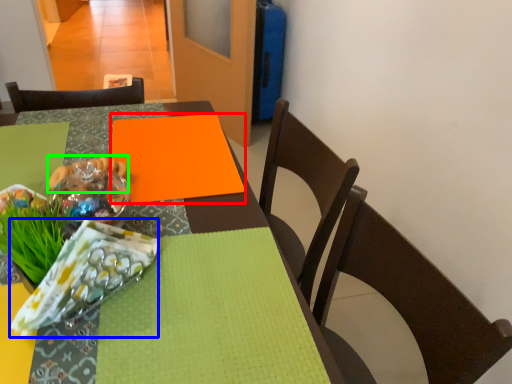
Question: Estimate the real-world distances between objects in this image. Which object is closer to linen (highlighted by a red box), material (highlighted by a blue box) or food (highlighted by a green box)?

Choices:
 (A) material
 (B) food

Answer: (B)